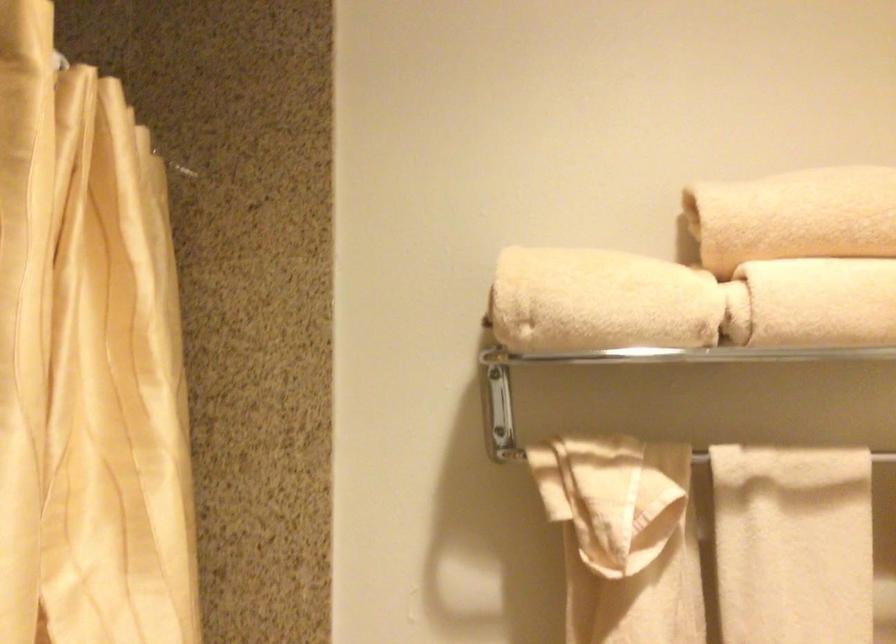
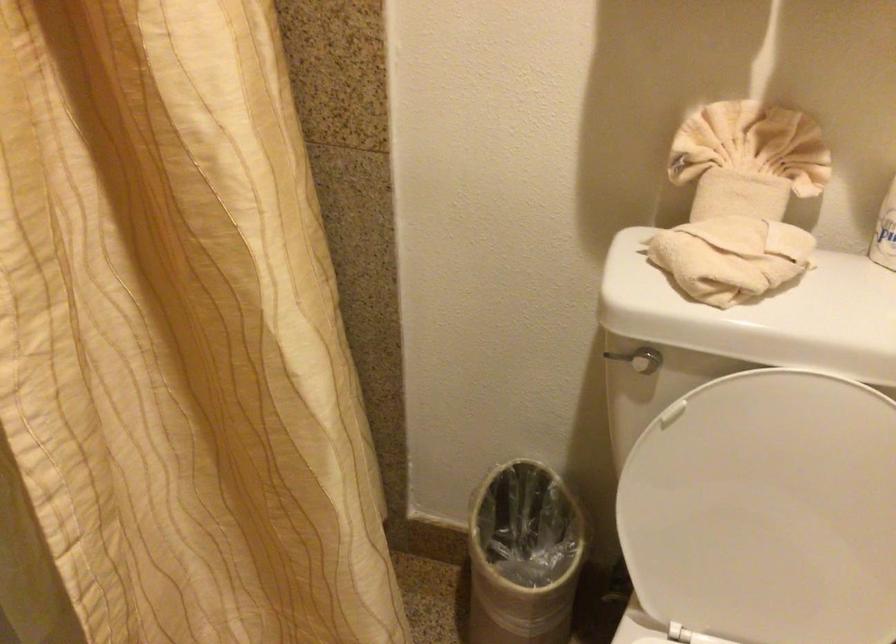
Question: How did the camera likely rotate?

Choices:
 (A) Left
 (B) Right
 (C) Up
 (D) Down

Answer: (D)